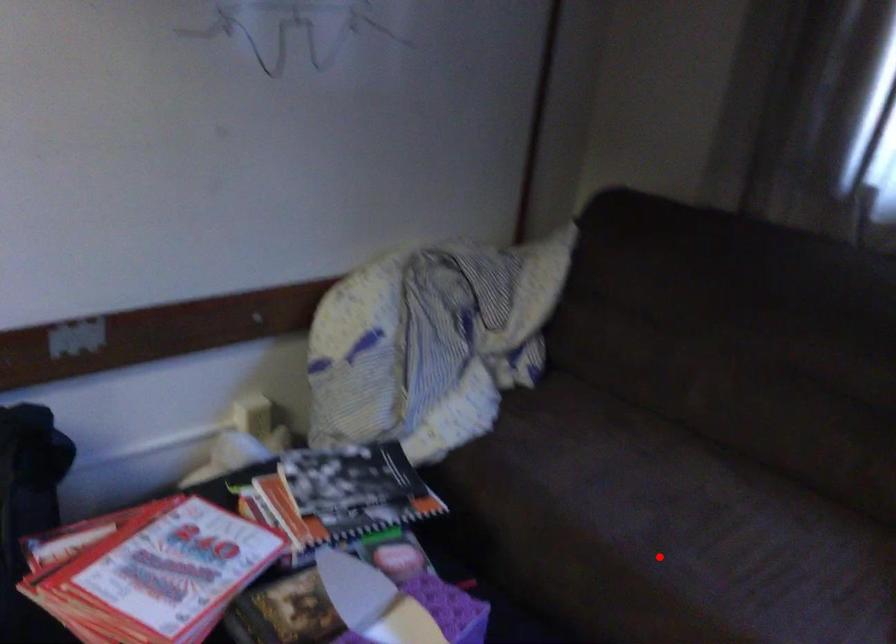
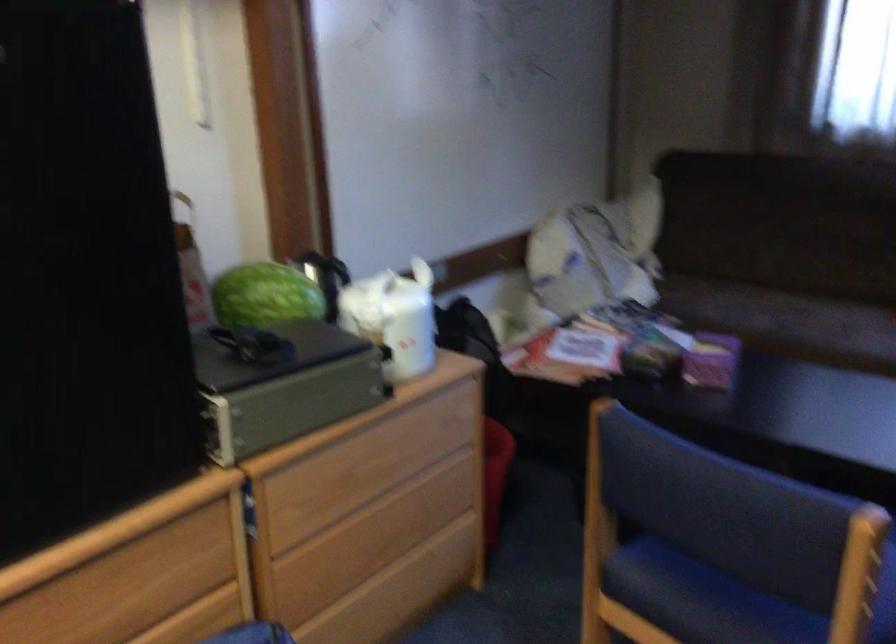
Where in the second image is the point corresponding to the highlighted location from the first image?

(787, 322)